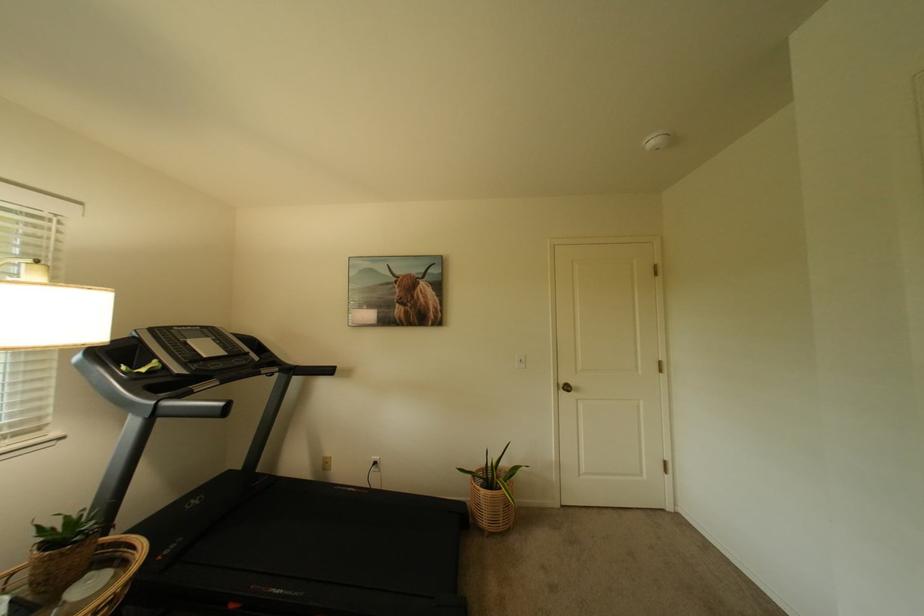
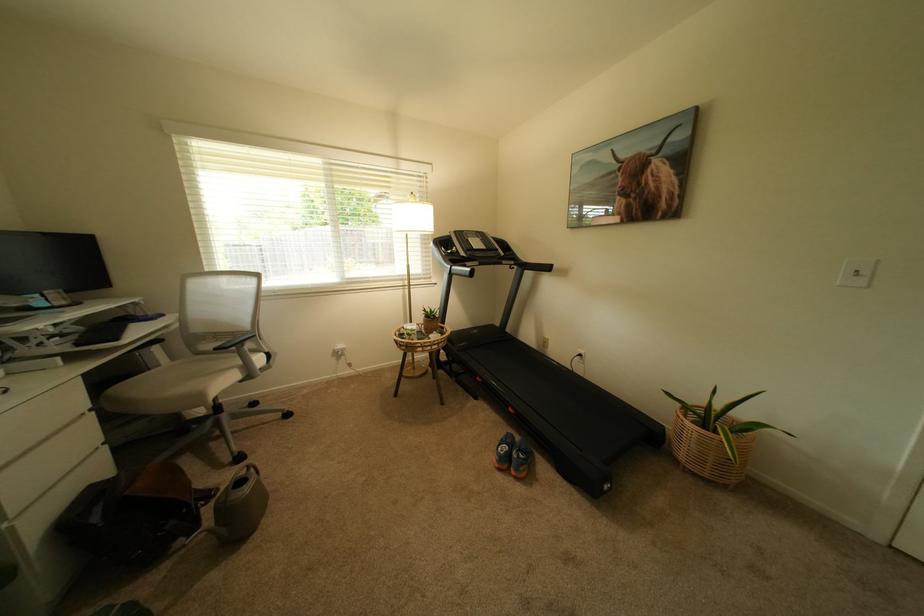
In the second image, find the point that corresponds to pixel 495 515 in the first image.

(695, 448)